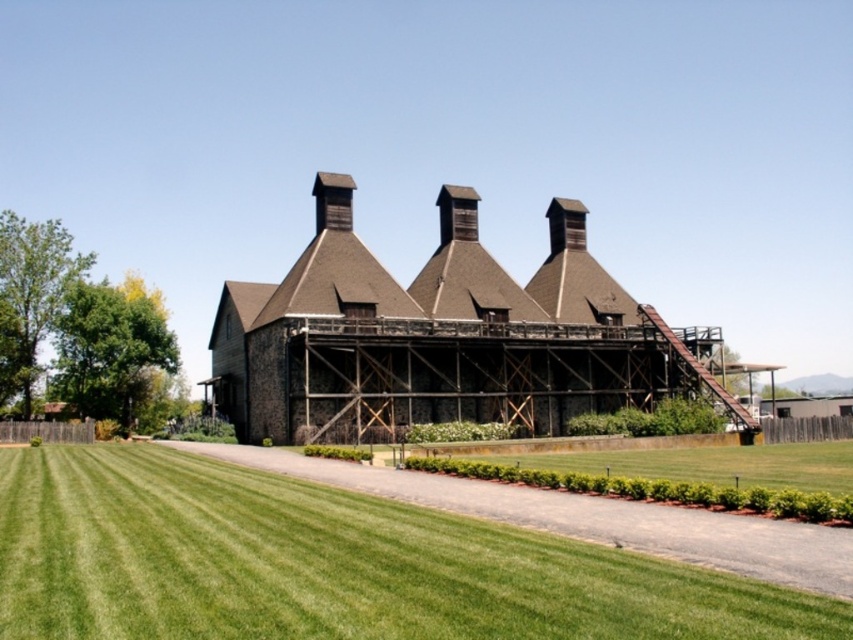
You are standing at the entrance of the building and see two points marked on the pathway. The first point is at coordinates point (x=55, y=632) and the second point is at point (x=428, y=285). Which point is closer to you?

Point (x=55, y=632) is closer to the viewer than point (x=428, y=285).

You are standing at the entrance of the brown wooden building at center and want to walk to the green grass at lower left. Which direction should you walk relative to the building?

The green grass at lower left is in front of the brown wooden building at center, so you should walk forward towards the green grass at lower left.

In the scene shown: You are a gardener planning to plant flowers along the edge of the green grass at lower left and the brown wooden building at center. Which area requires more flowers if you want to cover the same density of flowers per square meter?

The brown wooden building at center requires more flowers because the green grass at lower left has a smaller size compared to brown wooden building at center, so covering the same density would need more flowers for the larger area.